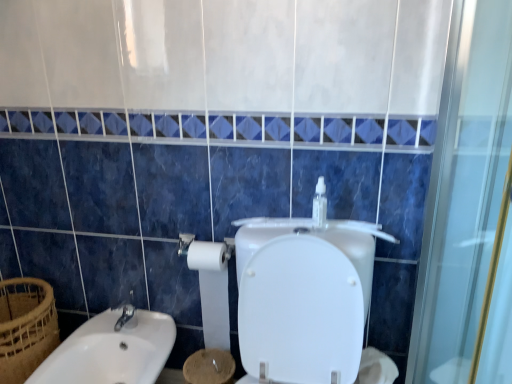
The image size is (512, 384). Describe the element at coordinates (111, 351) in the screenshot. I see `white glossy sink at lower left` at that location.

This screenshot has width=512, height=384. Identify the location of white matte toilet paper at lower right, the 2th toilet paper positioned from the left. (376, 368).

Image resolution: width=512 pixels, height=384 pixels. What do you see at coordinates (26, 327) in the screenshot?
I see `brown woven basket at lower left` at bounding box center [26, 327].

This screenshot has height=384, width=512. Describe the element at coordinates (320, 204) in the screenshot. I see `clear plastic bottle at upper center` at that location.

Where is `white glossy sink at lower left`? This screenshot has width=512, height=384. white glossy sink at lower left is located at coordinates (111, 351).

Based on their positions, is white matte toilet paper at lower right, the 2th toilet paper positioned from the left, located to the left or right of clear plastic bottle at upper center?

Clearly, white matte toilet paper at lower right, the 2th toilet paper positioned from the left, is on the right of clear plastic bottle at upper center in the image.

Considering their positions, is white matte toilet paper at lower right, the 2th toilet paper positioned from the left, located in front of or behind clear plastic bottle at upper center?

Clearly, white matte toilet paper at lower right, the 2th toilet paper positioned from the left, is in front of clear plastic bottle at upper center.

Which is correct: white matte toilet paper at lower right, which is the first toilet paper in right-to-left order, is inside clear plastic bottle at upper center, or outside of it?

white matte toilet paper at lower right, which is the first toilet paper in right-to-left order, lies outside clear plastic bottle at upper center.

Does point (380, 365) appear closer or farther from the camera than point (317, 205)?

Point (380, 365).

Can you confirm if white matte toilet paper at lower right, the 2th toilet paper positioned from the left, is positioned to the right of white glossy sink at lower left?

Yes, white matte toilet paper at lower right, the 2th toilet paper positioned from the left, is to the right of white glossy sink at lower left.

Which is further, (356,381) or (100,350)?

Positioned behind is point (100,350).

Looking at this image, is white matte toilet paper at lower right, which is the first toilet paper in right-to-left order, located outside white glossy sink at lower left?

white matte toilet paper at lower right, which is the first toilet paper in right-to-left order, lies outside white glossy sink at lower left's area.

Does white matte toilet paper at lower right, which is the first toilet paper in right-to-left order, have a lesser height compared to white glossy sink at lower left?

Indeed, white matte toilet paper at lower right, which is the first toilet paper in right-to-left order, has a lesser height compared to white glossy sink at lower left.

Considering the relative sizes of white matte toilet paper at lower right, the 2th toilet paper positioned from the left, and brown woven basket at lower left in the image provided, is white matte toilet paper at lower right, the 2th toilet paper positioned from the left, shorter than brown woven basket at lower left?

Yes.

Identify the location of basket below the white matte toilet paper at lower right, the 2th toilet paper positioned from the left (from a real-world perspective). (26, 327).

Which is more to the left, white matte toilet paper at lower right, the 2th toilet paper positioned from the left, or brown woven basket at lower left?

brown woven basket at lower left is more to the left.

Is white matte toilet paper at lower right, which is the first toilet paper in right-to-left order, beside brown woven basket at lower left?

No, white matte toilet paper at lower right, which is the first toilet paper in right-to-left order, is not beside brown woven basket at lower left.

Is clear plastic bottle at upper center inside the boundaries of white glossy sink at lower left, or outside?

clear plastic bottle at upper center is not enclosed by white glossy sink at lower left.

Which is in front, clear plastic bottle at upper center or white glossy sink at lower left?

white glossy sink at lower left is more forward.

Considering the relative sizes of clear plastic bottle at upper center and white glossy sink at lower left in the image provided, is clear plastic bottle at upper center bigger than white glossy sink at lower left?

No, clear plastic bottle at upper center is not bigger than white glossy sink at lower left.

Can you confirm if brown woven basket at lower left is positioned to the left of white glossy sink at lower left?

Yes.

Is brown woven basket at lower left positioned far away from white glossy sink at lower left?

No, brown woven basket at lower left is not far from white glossy sink at lower left.

From the image's perspective, is brown woven basket at lower left below white glossy sink at lower left?

No.

Considering the relative sizes of clear plastic bottle at upper center and brown woven basket at lower left in the image provided, is clear plastic bottle at upper center taller than brown woven basket at lower left?

In fact, clear plastic bottle at upper center may be shorter than brown woven basket at lower left.

From the image's perspective, who appears lower, clear plastic bottle at upper center or brown woven basket at lower left?

From the image's view, brown woven basket at lower left is below.

Between point (319, 190) and point (40, 280), which one is positioned in front?

The point (319, 190) is closer to the camera.

Is clear plastic bottle at upper center at the left side of brown woven basket at lower left?

In fact, clear plastic bottle at upper center is to the right of brown woven basket at lower left.

What are the coordinates of `sink in front of the white matte toilet paper at lower center, the first toilet paper when ordered from left to right` in the screenshot? It's located at (111, 351).

Which object is further away from the camera taking this photo, white glossy sink at lower left or white matte toilet paper at lower center, acting as the second toilet paper starting from the right?

white matte toilet paper at lower center, acting as the second toilet paper starting from the right, is further away from the camera.

Considering the sizes of white glossy sink at lower left and white matte toilet paper at lower center, the first toilet paper when ordered from left to right, in the image, is white glossy sink at lower left bigger or smaller than white matte toilet paper at lower center, the first toilet paper when ordered from left to right,?

In the image, white glossy sink at lower left appears to be larger than white matte toilet paper at lower center, the first toilet paper when ordered from left to right.

Where is `soap dispenser above the white matte toilet paper at lower right, which is the first toilet paper in right-to-left order (from the image's perspective)`? soap dispenser above the white matte toilet paper at lower right, which is the first toilet paper in right-to-left order (from the image's perspective) is located at coordinates (320, 204).

From the white glossy sink at lower left, count 1st toilet papers backward and point to it. Please provide its 2D coordinates.

[(376, 368)]

Based on their spatial positions, is white matte toilet paper at lower center, the first toilet paper when ordered from left to right, or white matte toilet paper at lower right, which is the first toilet paper in right-to-left order, closer to brown woven basket at lower left?

white matte toilet paper at lower center, the first toilet paper when ordered from left to right.

Looking at the image, which one is located closer to clear plastic bottle at upper center, white glossy sink at lower left or white matte toilet paper at lower center, acting as the second toilet paper starting from the right?

white matte toilet paper at lower center, acting as the second toilet paper starting from the right, is closer to clear plastic bottle at upper center.

Estimate the real-world distances between objects in this image. Which object is closer to white glossy sink at lower left, clear plastic bottle at upper center or white matte toilet paper at lower center, acting as the second toilet paper starting from the right?

white matte toilet paper at lower center, acting as the second toilet paper starting from the right, is closer to white glossy sink at lower left.

Estimate the real-world distances between objects in this image. Which object is closer to white matte toilet paper at lower center, acting as the second toilet paper starting from the right, white matte toilet paper at lower right, which is the first toilet paper in right-to-left order, or brown woven basket at lower left?

Based on the image, white matte toilet paper at lower right, which is the first toilet paper in right-to-left order, appears to be nearer to white matte toilet paper at lower center, acting as the second toilet paper starting from the right.

When comparing their distances from brown woven basket at lower left, does white matte toilet paper at lower right, which is the first toilet paper in right-to-left order, or white glossy sink at lower left seem closer?

white glossy sink at lower left lies closer to brown woven basket at lower left than the other object.

When comparing their distances from brown woven basket at lower left, does clear plastic bottle at upper center or white matte toilet paper at lower center, the first toilet paper when ordered from left to right, seem closer?

white matte toilet paper at lower center, the first toilet paper when ordered from left to right, is closer to brown woven basket at lower left.

When comparing their distances from white matte toilet paper at lower right, which is the first toilet paper in right-to-left order, does white matte toilet paper at lower center, the first toilet paper when ordered from left to right, or clear plastic bottle at upper center seem closer?

clear plastic bottle at upper center is closer to white matte toilet paper at lower right, which is the first toilet paper in right-to-left order.

From the image, which object appears to be farther from white matte toilet paper at lower center, the first toilet paper when ordered from left to right, clear plastic bottle at upper center or white glossy sink at lower left?

Based on the image, clear plastic bottle at upper center appears to be further to white matte toilet paper at lower center, the first toilet paper when ordered from left to right.

Locate an element on the screen. The height and width of the screenshot is (384, 512). toilet paper between clear plastic bottle at upper center and white matte toilet paper at lower right, the 2th toilet paper positioned from the left, in the up-down direction is located at coordinates (212, 290).

At what (x,y) coordinates should I click in order to perform the action: click on toilet paper between white glossy sink at lower left and white matte toilet paper at lower right, the 2th toilet paper positioned from the left. Please return your answer as a coordinate pair (x, y). This screenshot has width=512, height=384. Looking at the image, I should click on (212, 290).

At what (x,y) coordinates should I click in order to perform the action: click on toilet paper between brown woven basket at lower left and clear plastic bottle at upper center from left to right. Please return your answer as a coordinate pair (x, y). Image resolution: width=512 pixels, height=384 pixels. Looking at the image, I should click on (212, 290).

Where is `sink between brown woven basket at lower left and white matte toilet paper at lower right, the 2th toilet paper positioned from the left, in the horizontal direction`? This screenshot has height=384, width=512. sink between brown woven basket at lower left and white matte toilet paper at lower right, the 2th toilet paper positioned from the left, in the horizontal direction is located at coordinates (111, 351).